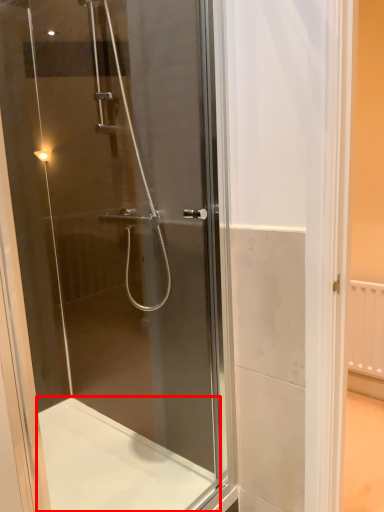
Question: Observing the image, what is the correct spatial positioning of bath (annotated by the red box) in reference to screen door?

Choices:
 (A) left
 (B) right

Answer: (A)